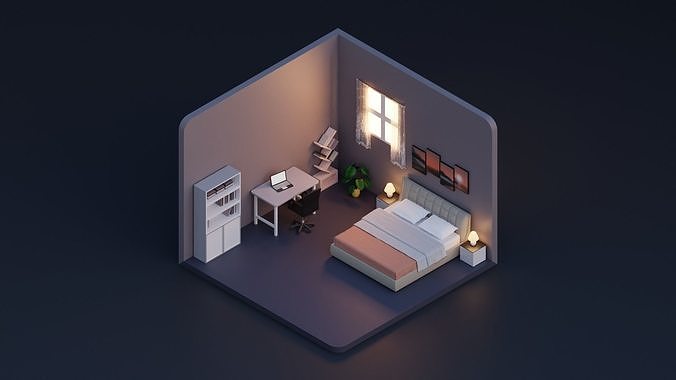
The image size is (676, 380). Identify the location of chair. (310, 202).